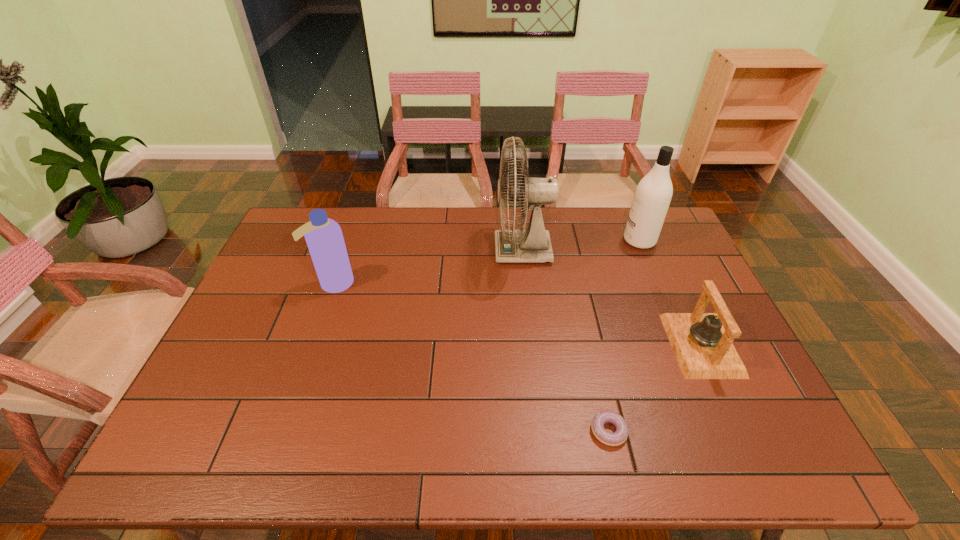
Locate an element on the screen. The image size is (960, 540). fan is located at coordinates (533, 244).

Locate an element on the screen. Image resolution: width=960 pixels, height=540 pixels. the farther shampoo is located at coordinates (653, 194).

This screenshot has width=960, height=540. I want to click on the right shampoo, so click(x=653, y=194).

Locate an element on the screen. the shorter shampoo is located at coordinates (324, 238).

The image size is (960, 540). I want to click on the third tallest object, so click(x=324, y=238).

This screenshot has width=960, height=540. What are the coordinates of `the fourth farthest object` in the screenshot? It's located at (702, 343).

Find the location of a particular element. The image size is (960, 540). bell is located at coordinates (702, 343).

Image resolution: width=960 pixels, height=540 pixels. In order to click on doughnut in this screenshot , I will do `click(617, 438)`.

At what (x,y) coordinates should I click in order to perform the action: click on the nearest object. Please return your answer as a coordinate pair (x, y). Looking at the image, I should click on (617, 438).

Find the location of a particular element. The image size is (960, 540). vacant region located 0.210m on the front-facing side of the fan is located at coordinates (432, 251).